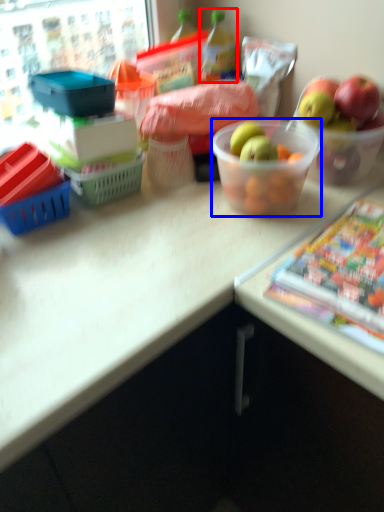
Question: Which object appears closest to the camera in this image, bottle (highlighted by a red box) or bowl (highlighted by a blue box)?

Choices:
 (A) bottle
 (B) bowl

Answer: (B)